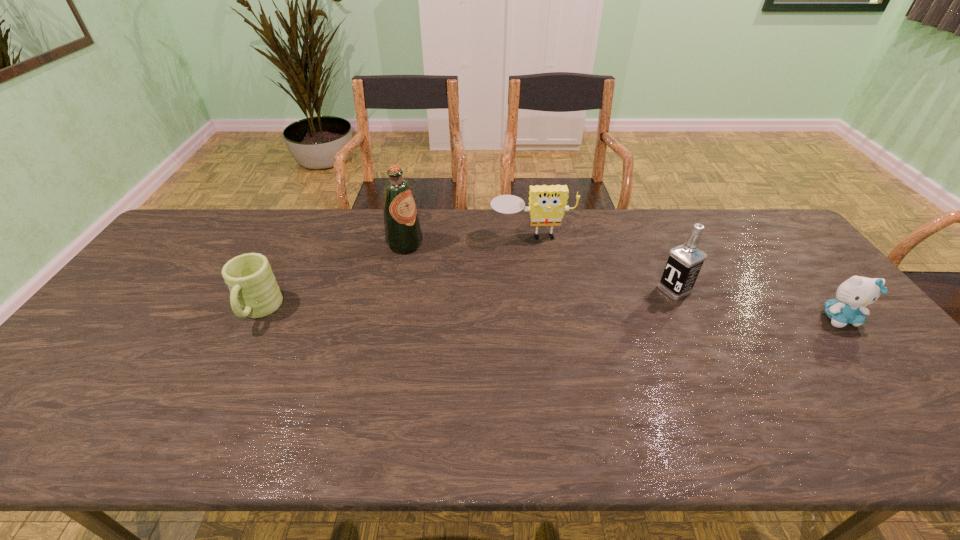
The height and width of the screenshot is (540, 960). What are the coordinates of `free space on the desktop that is between the leftmost object and the rightmost object and is positioned on the front-facing side of the third tallest object` in the screenshot? It's located at (548, 314).

Locate an element on the screen. Image resolution: width=960 pixels, height=540 pixels. vacant space on the desktop that is between the mug and the rightmost object and is positioned on the front label of the fourth shortest object is located at coordinates (622, 315).

I want to click on vacant spot on the desktop that is between the leftmost object and the kitten and is positioned on the front-facing side of the olive oil, so click(x=531, y=314).